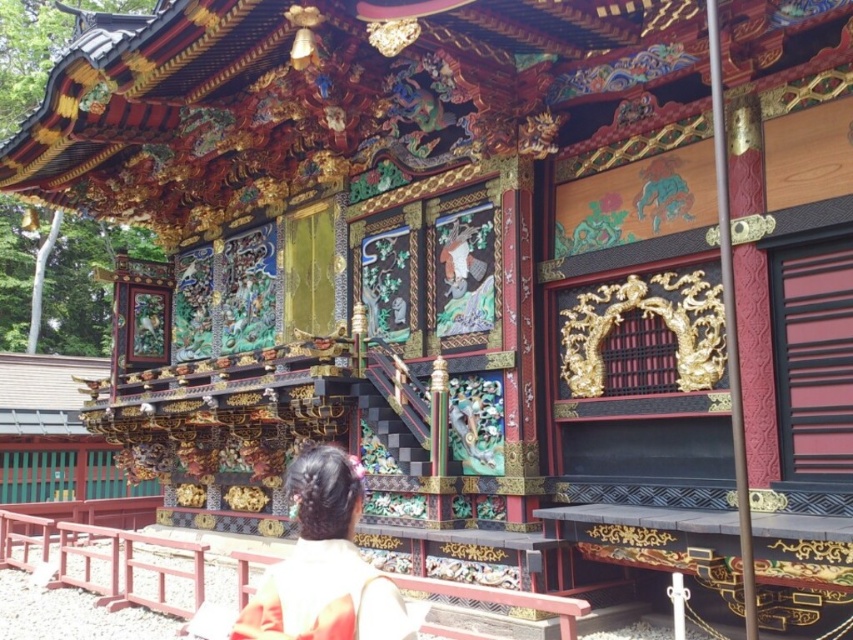
Question: Does wooden bench at lower center lie behind silk kimono at center?

Choices:
 (A) yes
 (B) no

Answer: (A)

Question: Does wooden bench at lower center appear under silk kimono at center?

Choices:
 (A) yes
 (B) no

Answer: (A)

Question: Which of the following is the farthest from the observer?

Choices:
 (A) wooden bench at lower center
 (B) silk kimono at center

Answer: (A)

Question: Can you confirm if wooden bench at lower center is smaller than silk kimono at center?

Choices:
 (A) no
 (B) yes

Answer: (A)